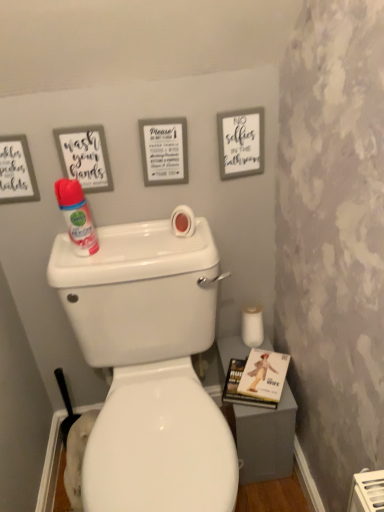
Where is `vacant area on top of hardcover book at lower right (from a real-world perspective)`? Image resolution: width=384 pixels, height=512 pixels. vacant area on top of hardcover book at lower right (from a real-world perspective) is located at coordinates (256, 370).